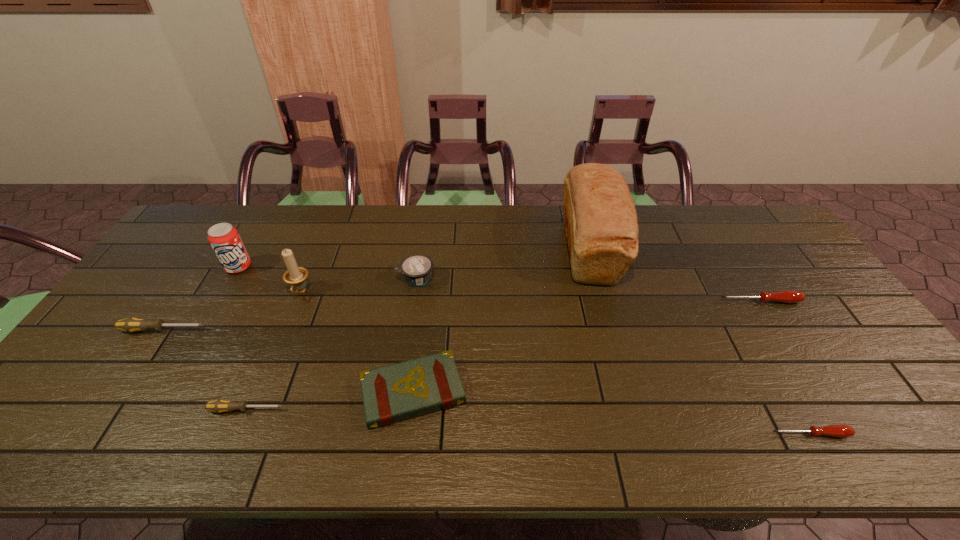
Find the location of `free spot between the brown bread and the leftmost screwdriver`. free spot between the brown bread and the leftmost screwdriver is located at coordinates (376, 289).

Where is `free area in between the soda can and the brown book`? The image size is (960, 540). free area in between the soda can and the brown book is located at coordinates (325, 329).

Image resolution: width=960 pixels, height=540 pixels. I want to click on vacant space that's between the candle_holder and the farthest screwdriver, so click(x=530, y=297).

Where is `object that is the closest to the farther gray screwdriver`? The image size is (960, 540). object that is the closest to the farther gray screwdriver is located at coordinates (223, 237).

Identify which object is located as the sixth nearest to the smaller red screwdriver. Please provide its 2D coordinates. Your answer should be formatted as a tuple, i.e. [(x, y)], where the tuple contains the x and y coordinates of a point satisfying the conditions above.

[(296, 276)]

Find the location of a particular element. Image resolution: width=960 pixels, height=540 pixels. screwdriver object that ranks as the second closest to the sixth shortest object is located at coordinates (132, 324).

Identify which screwdriver is the fourth closest to the brown bread. Please provide its 2D coordinates. Your answer should be formatted as a tuple, i.e. [(x, y)], where the tuple contains the x and y coordinates of a point satisfying the conditions above.

[(132, 324)]

Locate an element on the screen. vacant area in the image that satisfies the following two spatial constraints: 1. on the handle side of the farthest screwdriver; 2. on the right side of the candle_holder is located at coordinates (297, 301).

You are a GUI agent. You are given a task and a screenshot of the screen. Output one action in this format:
    pyautogui.click(x=<x>, y=<y>)
    Task: Click on the vacant space that satisfies the following two spatial constraints: 1. on the surface of the soda can; 2. on the left side of the sixth shortest object
    
    Given the screenshot: What is the action you would take?
    pyautogui.click(x=231, y=279)

You are a GUI agent. You are given a task and a screenshot of the screen. Output one action in this format:
    pyautogui.click(x=<x>, y=<y>)
    Task: Click on the vacant region that satisfies the following two spatial constraints: 1. on the front side of the nearest screwdriver; 2. on the left side of the yogurt
    This screenshot has height=540, width=960.
    Given the screenshot: What is the action you would take?
    pyautogui.click(x=393, y=434)